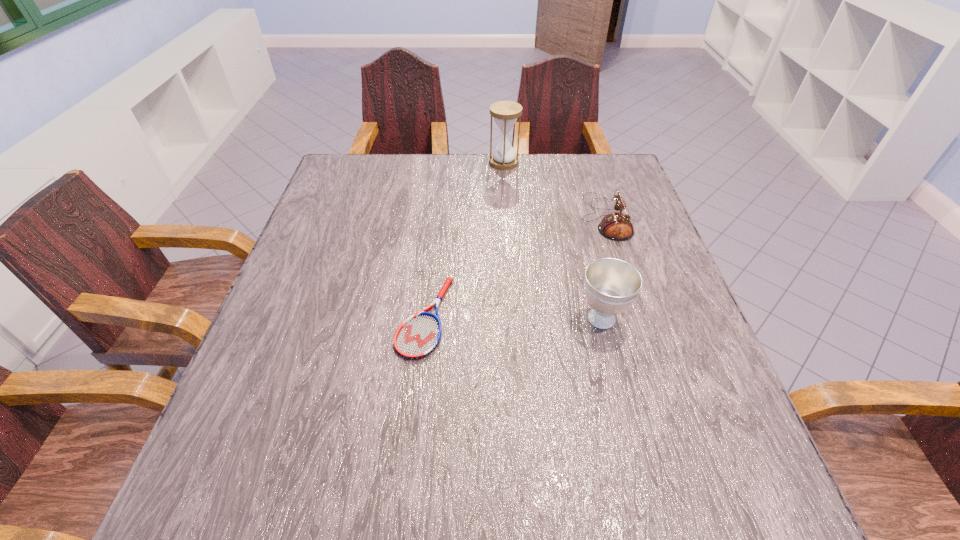
The height and width of the screenshot is (540, 960). What are the coordinates of `free space at the left edge` in the screenshot? It's located at (297, 282).

At what (x,y) coordinates should I click in order to perform the action: click on vacant space at the right edge of the desktop. Please return your answer as a coordinate pair (x, y). The width and height of the screenshot is (960, 540). Looking at the image, I should click on (595, 226).

You are a GUI agent. You are given a task and a screenshot of the screen. Output one action in this format:
    pyautogui.click(x=<x>, y=<y>)
    Task: Click on the vacant region at the far left corner of the desktop
    
    Given the screenshot: What is the action you would take?
    pyautogui.click(x=357, y=153)

Where is `free space at the far right corner`? The image size is (960, 540). free space at the far right corner is located at coordinates (595, 168).

Image resolution: width=960 pixels, height=540 pixels. I want to click on free space that is in between the hourglass and the tennis racket, so click(465, 240).

The image size is (960, 540). What are the coordinates of `free space between the telephone and the third object from right to left` in the screenshot? It's located at (555, 190).

Image resolution: width=960 pixels, height=540 pixels. In order to click on free space between the hourglass and the leftmost object in this screenshot , I will do `click(465, 240)`.

You are a GUI agent. You are given a task and a screenshot of the screen. Output one action in this format:
    pyautogui.click(x=<x>, y=<y>)
    Task: Click on the free point between the tallest object and the chalice
    This screenshot has height=540, width=960.
    Given the screenshot: What is the action you would take?
    pyautogui.click(x=553, y=240)

At what (x,y) coordinates should I click in order to perform the action: click on empty location between the farthest object and the shortest object. Please return your answer as a coordinate pair (x, y). Image resolution: width=960 pixels, height=540 pixels. Looking at the image, I should click on (465, 240).

In order to click on blank region between the hourglass and the chalice in this screenshot , I will do `click(553, 240)`.